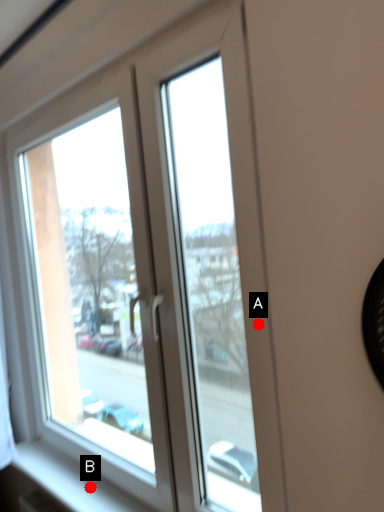
Question: Two points are circled on the image, labeled by A and B beside each circle. Which point is closer to the camera?

Choices:
 (A) A is closer
 (B) B is closer

Answer: (A)